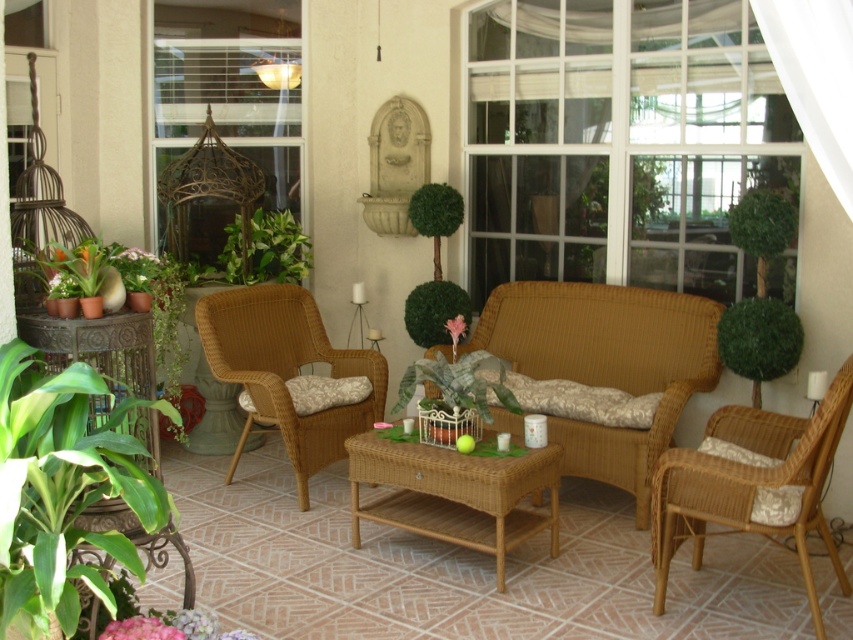
Can you confirm if woven wicker couch at center is taller than white sheer curtain at upper right?

Correct, woven wicker couch at center is much taller as white sheer curtain at upper right.

Is point (688, 365) positioned before point (810, 118)?

No, (688, 365) is behind (810, 118).

This screenshot has width=853, height=640. What are the coordinates of `woven wicker couch at center` in the screenshot? It's located at (607, 364).

Does woven wicker couch at center have a larger size compared to green matte ball at center?

Yes, woven wicker couch at center is bigger than green matte ball at center.

Can you confirm if woven wicker couch at center is positioned to the left of green matte ball at center?

No, woven wicker couch at center is not to the left of green matte ball at center.

Is point (538, 340) behind point (424, 333)?

No, (538, 340) is in front of (424, 333).

Locate an element on the screen. Image resolution: width=853 pixels, height=640 pixels. woven wicker couch at center is located at coordinates (607, 364).

Looking at this image, can you confirm if green matte ball at center is positioned above green leafy bush at center?

Actually, green matte ball at center is below green leafy bush at center.

Who is more distant from viewer, (421, 339) or (457, 189)?

Positioned behind is point (457, 189).

Where is `green matte ball at center`? This screenshot has height=640, width=853. green matte ball at center is located at coordinates (434, 310).